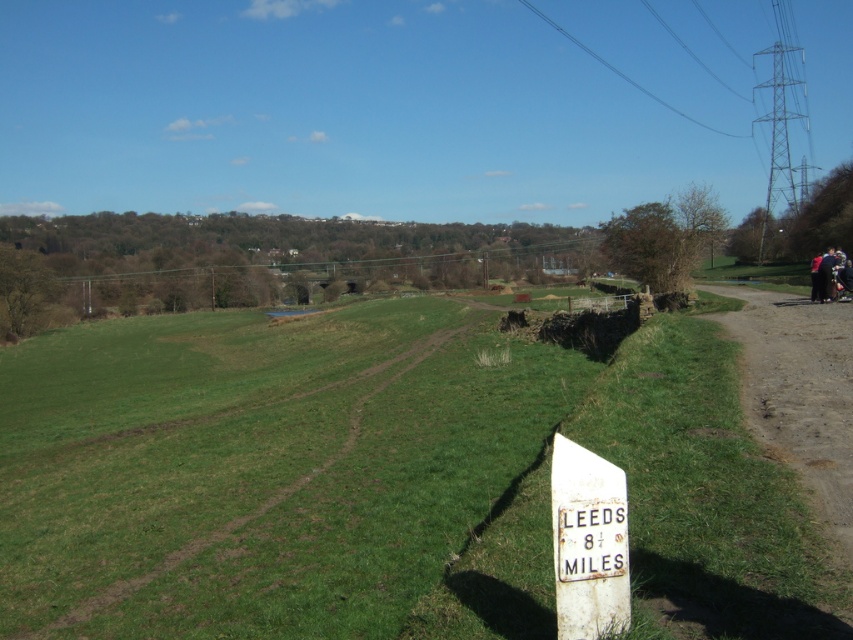
Is point (579, 372) less distant than point (152, 248)?

Yes, point (579, 372) is closer to viewer.

Image resolution: width=853 pixels, height=640 pixels. Identify the location of green grassy at lower left. (381, 480).

Is brown wooden power line at upper center smaller than white weathered signpost at lower right?

Actually, brown wooden power line at upper center might be larger than white weathered signpost at lower right.

In the scene shown: Can you confirm if brown wooden power line at upper center is shorter than white weathered signpost at lower right?

No, brown wooden power line at upper center is not shorter than white weathered signpost at lower right.

The height and width of the screenshot is (640, 853). I want to click on brown wooden power line at upper center, so click(x=355, y=257).

This screenshot has height=640, width=853. Find the location of `green grassy at lower left`. green grassy at lower left is located at coordinates (381, 480).

In the scene shown: Who is positioned more to the right, green grassy at lower left or white weathered signpost at lower right?

white weathered signpost at lower right

Image resolution: width=853 pixels, height=640 pixels. What do you see at coordinates (381, 480) in the screenshot? I see `green grassy at lower left` at bounding box center [381, 480].

This screenshot has height=640, width=853. Identify the location of green grassy at lower left. (381, 480).